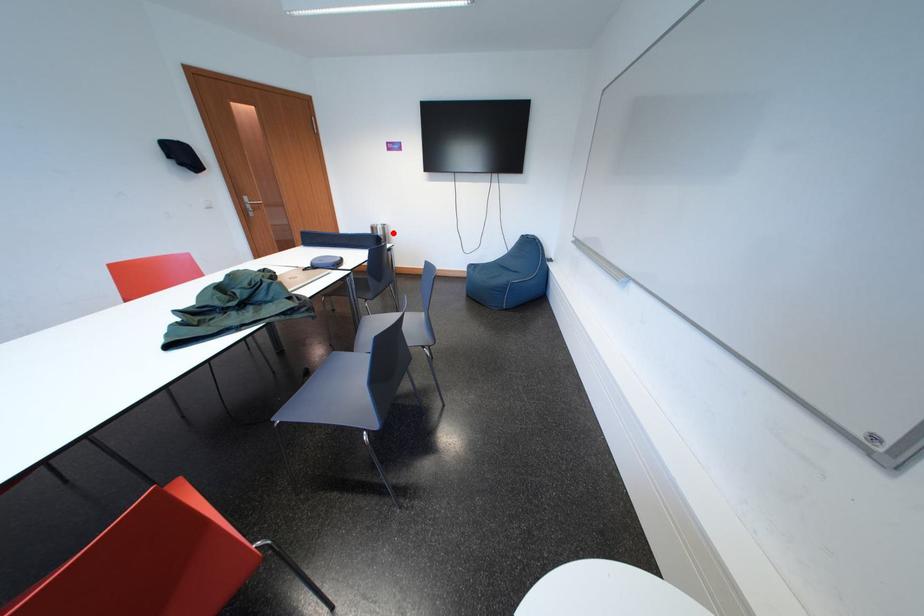
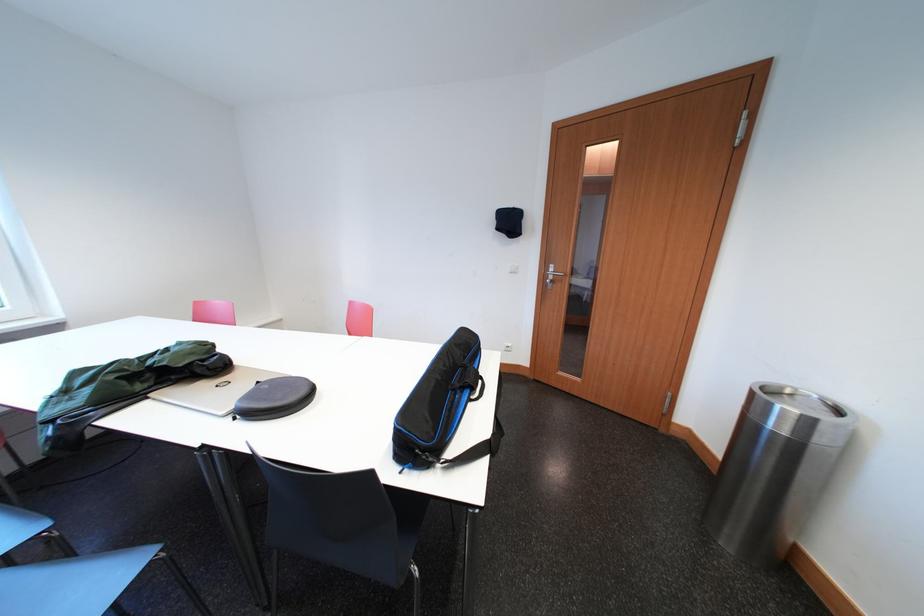
Question: I am providing you with two images of the same scene from different viewpoints. A red point is shown in image1. For the corresponding object point in image2, is it positioned nearer or farther from the camera?

Choices:
 (A) Nearer
 (B) Farther

Answer: (B)